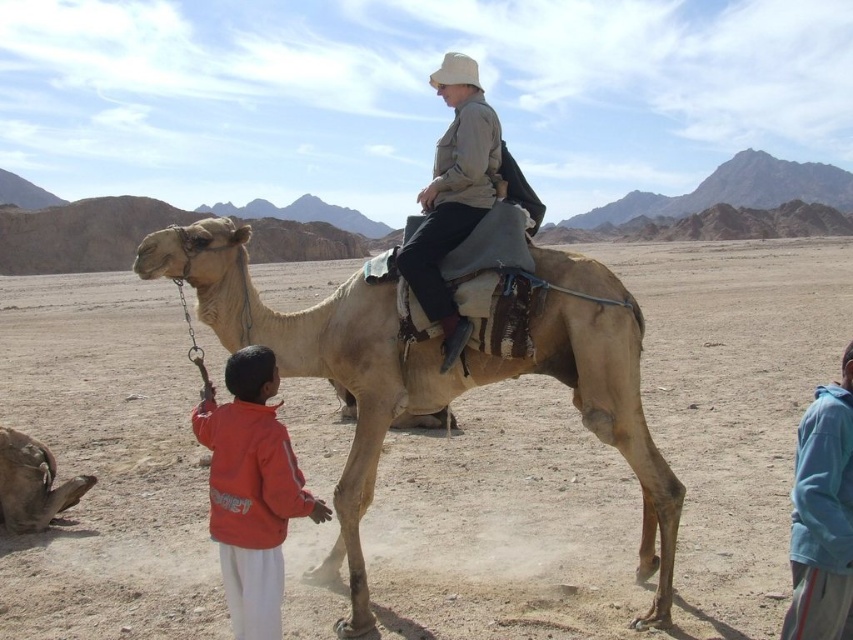
Based on the photo, you are a photographer standing in the desert scene. You need to position yourself to capture both the red fleece jacket at lower left and the light brown leather camel at lower left in the same frame. Which object should you move closer to in order to include both in your shot?

To include both the red fleece jacket at lower left and the light brown leather camel at lower left in the same frame, you should move closer to the light brown leather camel at lower left since the red fleece jacket at lower left is positioned to the right of it.

You are a photographer trying to capture a photo of the beige rough camel at center and the red fleece jacket at lower left. Based on their positions, which object should you focus on first if you want to include both in the same frame without moving the camera?

The beige rough camel at center is positioned on the left side of the red fleece jacket at lower left, so you should focus on the beige rough camel at center first to ensure both are in the frame.

Based on the photo, you are a photographer standing at the edge of the desert, wanting to capture a photo of the beige rough camel at center and the red fleece jacket at lower left in the same frame. Given that your camera has a maximum focus range of 2 meters, will both subjects be in focus if they are at their current positions?

The distance between the beige rough camel at center and the red fleece jacket at lower left is 2.33 meters. Since the camera can only focus within 2 meters, the subjects are slightly out of the focus range. Therefore, both subjects cannot be in focus simultaneously.